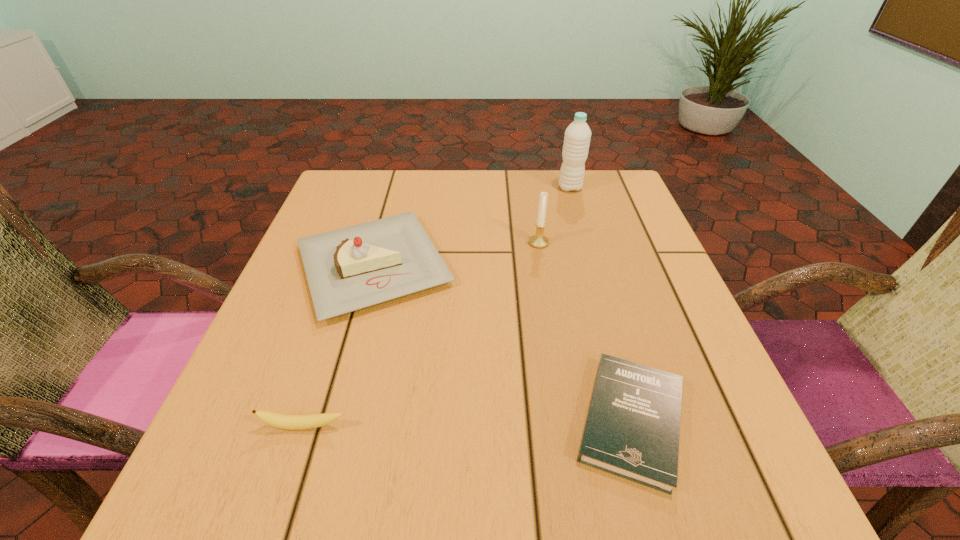
The height and width of the screenshot is (540, 960). Find the location of `free spot between the farthest object and the shortest object`. free spot between the farthest object and the shortest object is located at coordinates (600, 304).

Find the location of a particular element. The width and height of the screenshot is (960, 540). empty location between the cake and the candle holder is located at coordinates (456, 254).

Where is `vacant region between the banana and the cake`? The image size is (960, 540). vacant region between the banana and the cake is located at coordinates (339, 346).

Find the location of a particular element. vacant area between the cake and the shortest object is located at coordinates coord(502,343).

The height and width of the screenshot is (540, 960). I want to click on vacant point located between the banana and the book, so click(x=468, y=424).

The image size is (960, 540). What are the coordinates of `vacant space that is in between the book and the second shortest object` in the screenshot? It's located at (468, 424).

Locate which object is the closest to the shortest object. Please provide its 2D coordinates. Your answer should be formatted as a tuple, i.e. [(x, y)], where the tuple contains the x and y coordinates of a point satisfying the conditions above.

[(351, 268)]

Choose which object is the third nearest neighbor to the candle holder. Please provide its 2D coordinates. Your answer should be formatted as a tuple, i.e. [(x, y)], where the tuple contains the x and y coordinates of a point satisfying the conditions above.

[(632, 429)]

I want to click on free location that satisfies the following two spatial constraints: 1. on the back side of the third tallest object; 2. on the left side of the candle holder, so click(380, 242).